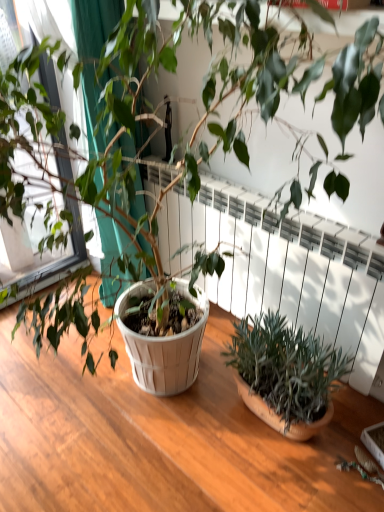
Where is `vacant point above white textured radiator at center (from a real-world perspective)`? vacant point above white textured radiator at center (from a real-world perspective) is located at coordinates (290, 211).